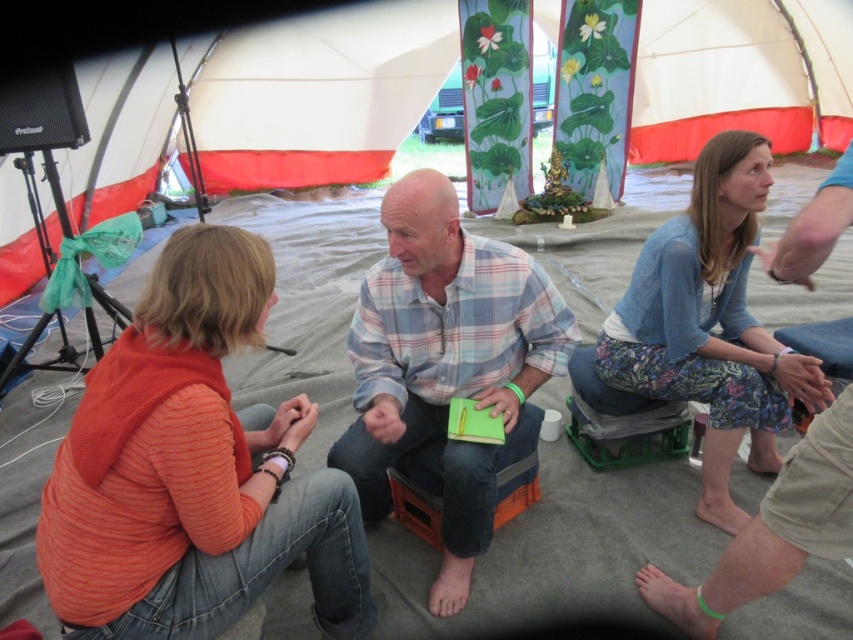
You are standing at the entrance of the tent and want to place a new orange sweater at lower left. Where exactly should you place it?

Place the orange sweater at lower left at point (192, 470).

You are organizing a group activity and need to ensure there is enough space between participants. The plaid shirt at center and the blue knitted sweater at upper right are seated in the tent. Based on their positions, which participant requires more horizontal space for their seating area?

The plaid shirt at center requires more horizontal space because it might be wider than the blue knitted sweater at upper right according to the description.

You are organizing a clothing donation drive and need to categorize items by size. You have an orange sweater at lower left and a plaid shirt at center. Which item is more suitable for a smaller individual?

The orange sweater at lower left has a smaller size compared to the plaid shirt at center, so it is more suitable for a smaller individual.